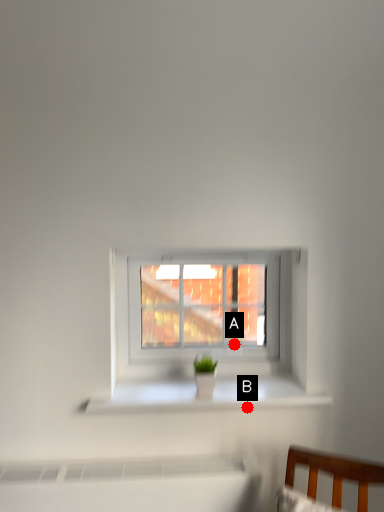
Question: Two points are circled on the image, labeled by A and B beside each circle. Which point is farther from the camera taking this photo?

Choices:
 (A) A is further
 (B) B is further

Answer: (A)